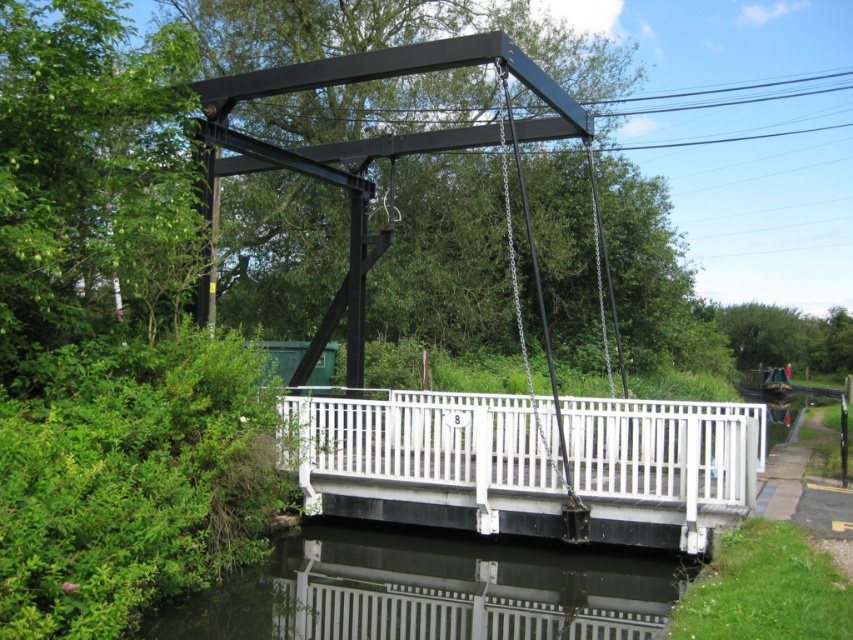
You are standing on the path leading to the white painted wood bridge at center and the transparent glass water at lower center. Which object is closer to you as you approach?

The white painted wood bridge at center is closer to you because it is further to the viewer than the transparent glass water at lower center, meaning it appears nearer in the scene.

You are standing on the drawbridge and want to walk to the point labeled point (489,596). Which direction should you face to move towards it from point (442,500)?

Since point (442,500) is behind point (489,596), you should face away from the direction of point (489,596) to move towards it from point (442,500).

You are standing at point (527, 461). Looking around, you see a white painted wood bridge at center. Which direction should you walk to reach the bridge?

The white painted wood bridge at center is located at your current position, so you are already at the bridge.